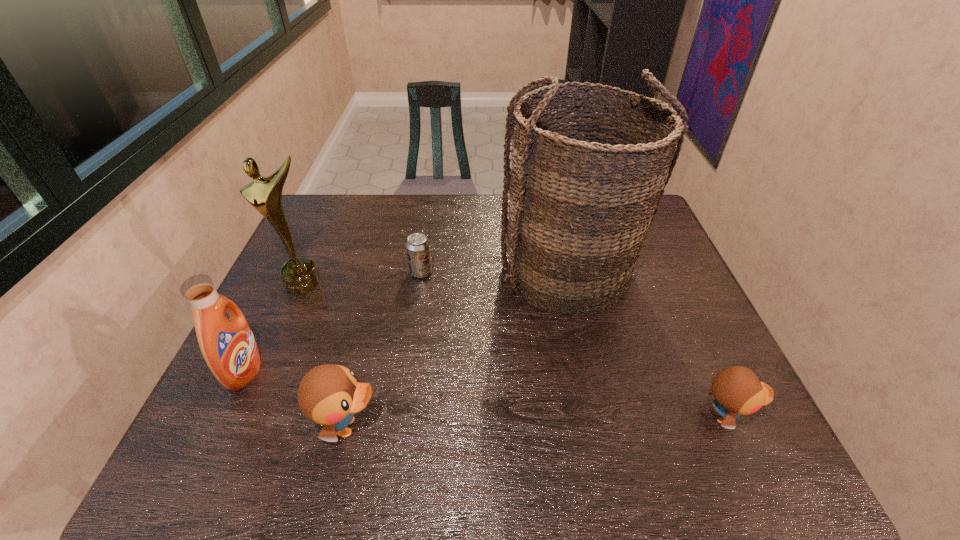
This screenshot has height=540, width=960. What are the coordinates of `free spot between the fourth shortest object and the shorter duck` in the screenshot? It's located at (486, 395).

At what (x,y) coordinates should I click in order to perform the action: click on blank region between the taller duck and the tallest object. Please return your answer as a coordinate pair (x, y). This screenshot has width=960, height=540. Looking at the image, I should click on (458, 350).

Locate an element on the screen. This screenshot has height=540, width=960. unoccupied area between the third object from right to left and the tallest object is located at coordinates (494, 273).

I want to click on free space between the fourth object from left to right and the basket, so click(494, 273).

This screenshot has height=540, width=960. I want to click on unoccupied area between the fourth shortest object and the fourth object from right to left, so click(297, 400).

Where is `free space that is in between the tallest object and the fourth object from left to right`? free space that is in between the tallest object and the fourth object from left to right is located at coordinates (494, 273).

What are the coordinates of `unoccupied area between the left duck and the third tallest object` in the screenshot? It's located at (297, 400).

Find the location of a particular element. The image size is (960, 540). blank region between the fourth shortest object and the fifth shortest object is located at coordinates (275, 327).

You are a GUI agent. You are given a task and a screenshot of the screen. Output one action in this format:
    pyautogui.click(x=<x>, y=<y>)
    Task: Click on the object that is the nearest to the second tallest object
    Image resolution: width=960 pixels, height=540 pixels.
    Given the screenshot: What is the action you would take?
    pyautogui.click(x=228, y=346)

Select which object is the third closest to the fourth object from left to right. Please provide its 2D coordinates. Your answer should be formatted as a tuple, i.e. [(x, y)], where the tuple contains the x and y coordinates of a point satisfying the conditions above.

[(228, 346)]